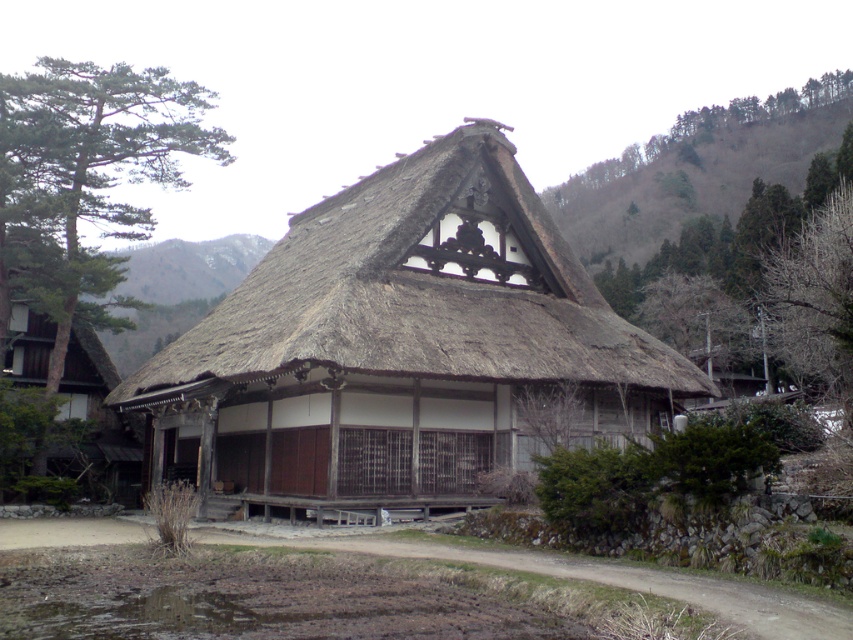
Question: Estimate the real-world distances between objects in this image. Which object is farther from the brown thatch at center?

Choices:
 (A) green leafy tree at left
 (B) wooden door at left

Answer: (A)

Question: Estimate the real-world distances between objects in this image. Which object is farther from the wooden door at left?

Choices:
 (A) brown thatch at center
 (B) green leafy tree at left

Answer: (A)

Question: Is brown thatch at center thinner than wooden door at left?

Choices:
 (A) yes
 (B) no

Answer: (B)

Question: Is brown thatch at center to the right of green leafy tree at left from the viewer's perspective?

Choices:
 (A) yes
 (B) no

Answer: (A)

Question: Among these objects, which one is farthest from the camera?

Choices:
 (A) brown thatch at center
 (B) wooden door at left

Answer: (B)

Question: Is brown thatch at center positioned behind green leafy tree at left?

Choices:
 (A) yes
 (B) no

Answer: (B)